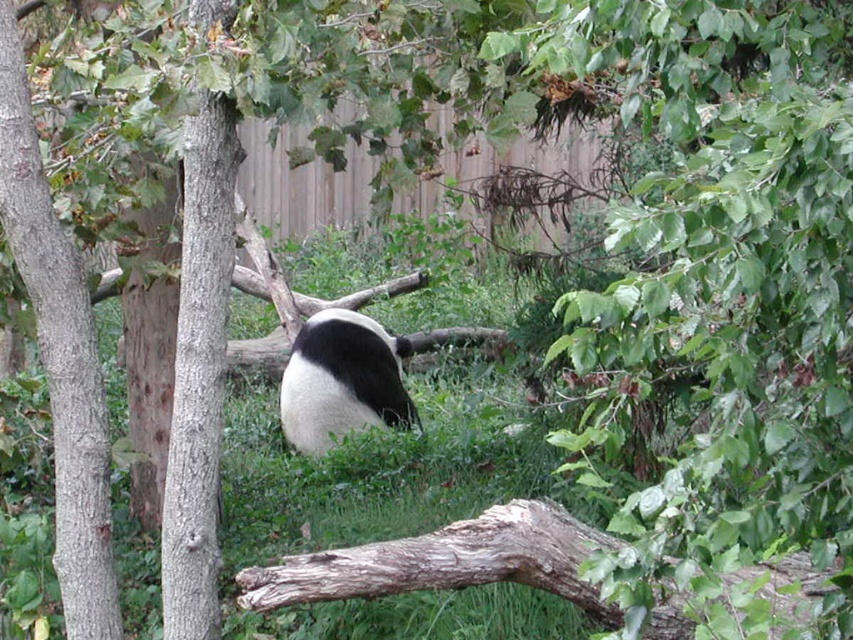
You are a zookeeper trying to locate the gray rough bark tree trunk at left in the panda enclosure. According to the coordinates provided, where exactly is it positioned?

The gray rough bark tree trunk at left is located at point (x=199, y=371), which means it is positioned in the lower left area of the enclosure based on the coordinate system provided.

You are a zookeeper trying to determine which tree trunk to use for a climbing structure for the pandas. You need to choose the wider tree trunk. Which one should you select between the brown rough tree trunk at left and the gray rough bark tree trunk at left?

The gray rough bark tree trunk at left is wider than the brown rough tree trunk at left, so you should select the gray rough bark tree trunk at left for the climbing structure.

You are a photographer trying to capture a closeup of the panda in the center. You notice two points in the image labeled as point 1 at coordinates point (x=108, y=502) and point 2 at coordinates point (x=195, y=400). Which point is closer to your camera lens?

Point (x=108, y=502) is closer to the camera lens than point (x=195, y=400) because it is further to the camera than the other point.